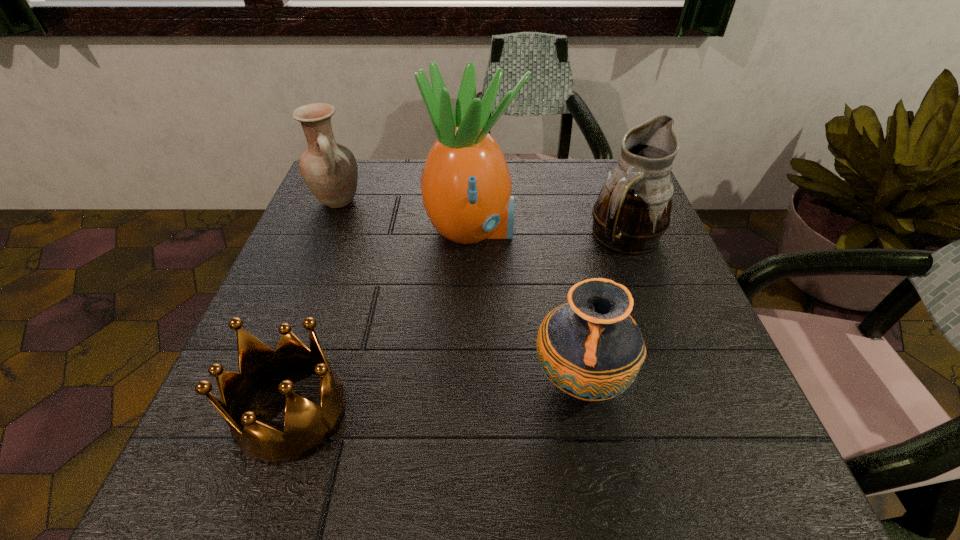
Identify the location of vacant position located 0.330m on the back of the shortest object. (348, 241).

Find the location of a particular element. Image resolution: width=960 pixels, height=540 pixels. pineapple present at the far edge is located at coordinates (466, 186).

Where is `pottery that is at the far edge`? Image resolution: width=960 pixels, height=540 pixels. pottery that is at the far edge is located at coordinates (329, 169).

You are a GUI agent. You are given a task and a screenshot of the screen. Output one action in this format:
    pyautogui.click(x=<x>, y=<y>)
    Task: Click on the object at the near edge
    This screenshot has height=540, width=960.
    Given the screenshot: What is the action you would take?
    pyautogui.click(x=307, y=426)

I want to click on pottery at the left edge, so (329, 169).

Locate an element on the screen. This screenshot has height=540, width=960. crown located in the left edge section of the desktop is located at coordinates (307, 426).

At what (x,y) coordinates should I click in order to perform the action: click on object at the right edge. Please return your answer as a coordinate pair (x, y). Looking at the image, I should click on (632, 212).

Identify the location of object at the far left corner. (329, 169).

Locate an element on the screen. object that is at the near left corner is located at coordinates (307, 426).

Locate an element on the screen. This screenshot has width=960, height=540. vacant region at the far edge of the desktop is located at coordinates (385, 187).